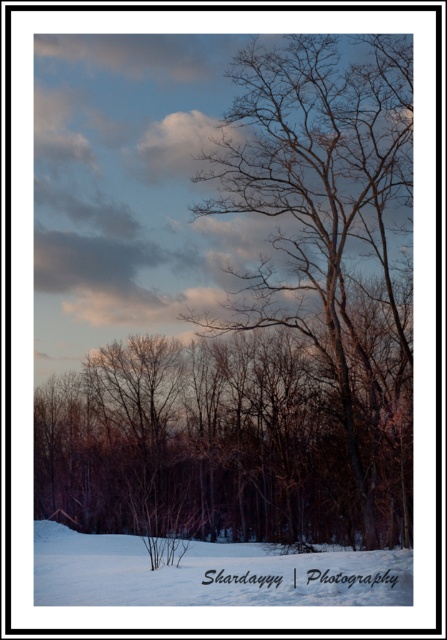
Question: Where is bare branches at center located in relation to white powdery snow at lower left in the image?

Choices:
 (A) right
 (B) left

Answer: (A)

Question: In this image, where is bare branches at center located relative to white powdery snow at lower left?

Choices:
 (A) right
 (B) left

Answer: (A)

Question: Which point appears farthest from the camera in this image?

Choices:
 (A) (205, 579)
 (B) (409, 346)

Answer: (B)

Question: Which object is closer to the camera taking this photo?

Choices:
 (A) white powdery snow at lower left
 (B) bare branches at center

Answer: (A)

Question: Considering the relative positions of bare branches at center and white powdery snow at lower left in the image provided, where is bare branches at center located with respect to white powdery snow at lower left?

Choices:
 (A) left
 (B) right

Answer: (B)